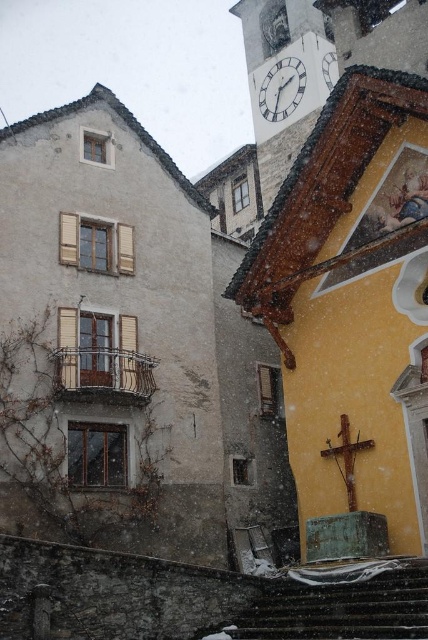
Question: Can you confirm if snow-covered stone stairs at lower center is positioned below white glossy clock at upper center?

Choices:
 (A) yes
 (B) no

Answer: (A)

Question: Does snow-covered stone stairs at lower center have a lesser width compared to white glossy clock at upper center?

Choices:
 (A) no
 (B) yes

Answer: (A)

Question: Considering the relative positions of snow-covered stone stairs at lower center and white glossy clock at upper center in the image provided, where is snow-covered stone stairs at lower center located with respect to white glossy clock at upper center?

Choices:
 (A) below
 (B) above

Answer: (A)

Question: Which object appears closest to the camera in this image?

Choices:
 (A) white glossy clock at upper center
 (B) snow-covered stone stairs at lower center

Answer: (B)

Question: Which point appears farthest from the camera in this image?

Choices:
 (A) (380, 561)
 (B) (296, 74)

Answer: (B)